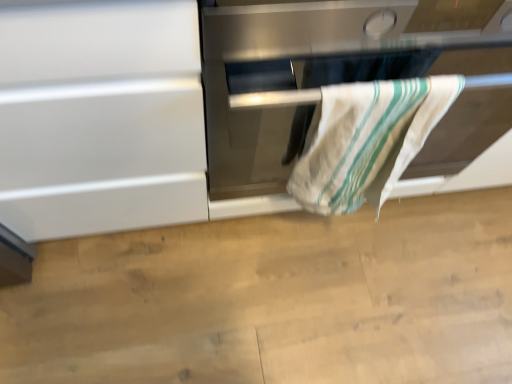
Image resolution: width=512 pixels, height=384 pixels. What do you see at coordinates (343, 81) in the screenshot?
I see `stainless steel oven at center` at bounding box center [343, 81].

You are a GUI agent. You are given a task and a screenshot of the screen. Output one action in this format:
    pyautogui.click(x=<x>, y=<y>)
    Task: Click on the stainless steel oven at center
    The image size is (512, 384).
    Given the screenshot: What is the action you would take?
    pyautogui.click(x=343, y=81)

This screenshot has height=384, width=512. What are the coordinates of `stainless steel oven at center` in the screenshot? It's located at (343, 81).